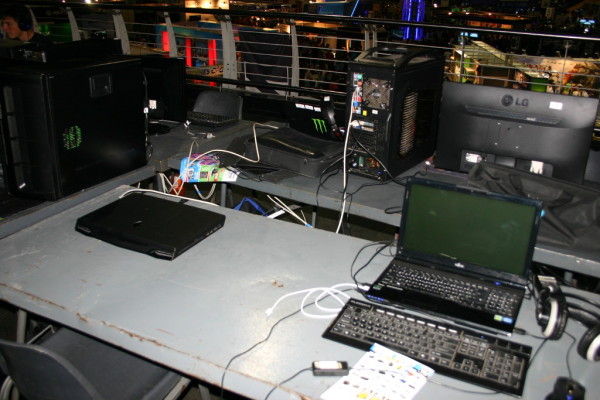
In order to click on keyboard in this screenshot , I will do pyautogui.click(x=478, y=350).